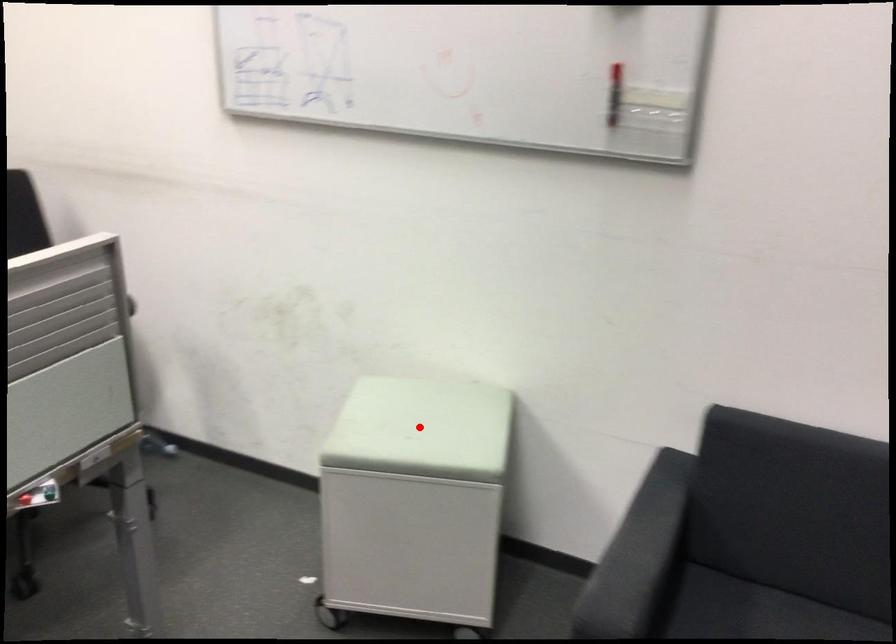
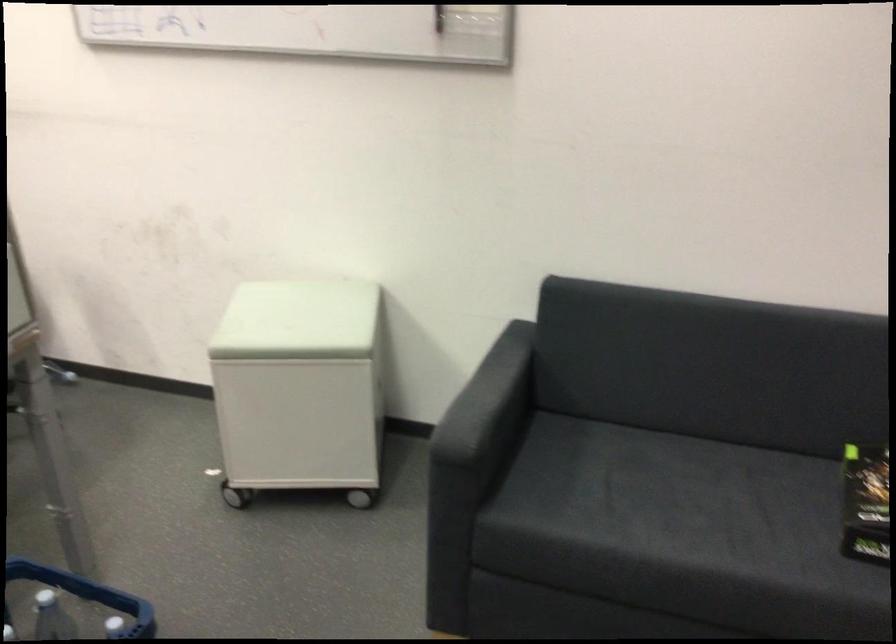
Question: I am providing you with two images of the same scene from different viewpoints. A red point is marked on the first image. Is the red point's position out of view in image 2?

Choices:
 (A) Yes
 (B) No

Answer: (B)